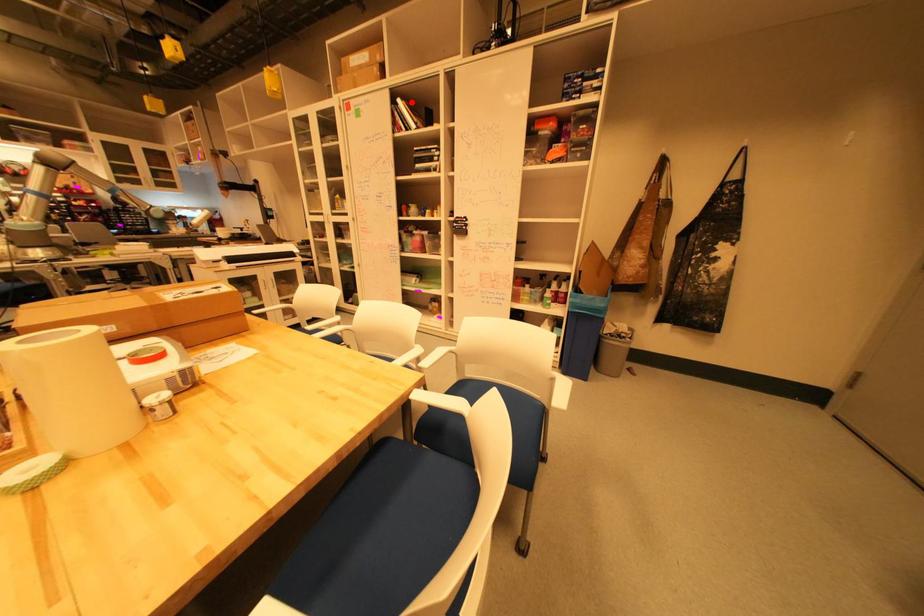
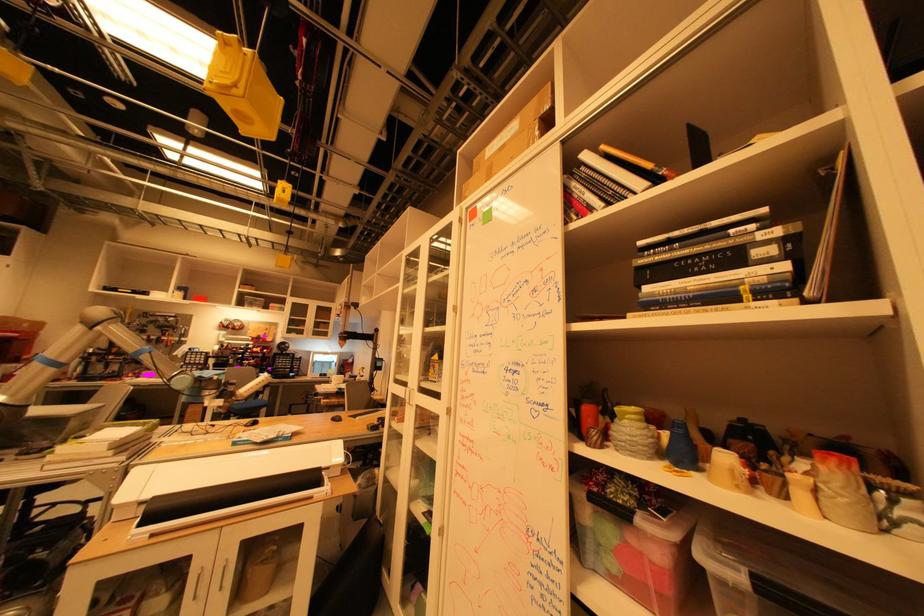
Where in the second image is the point corresponding to the highlighted location from the first image?

(598, 156)